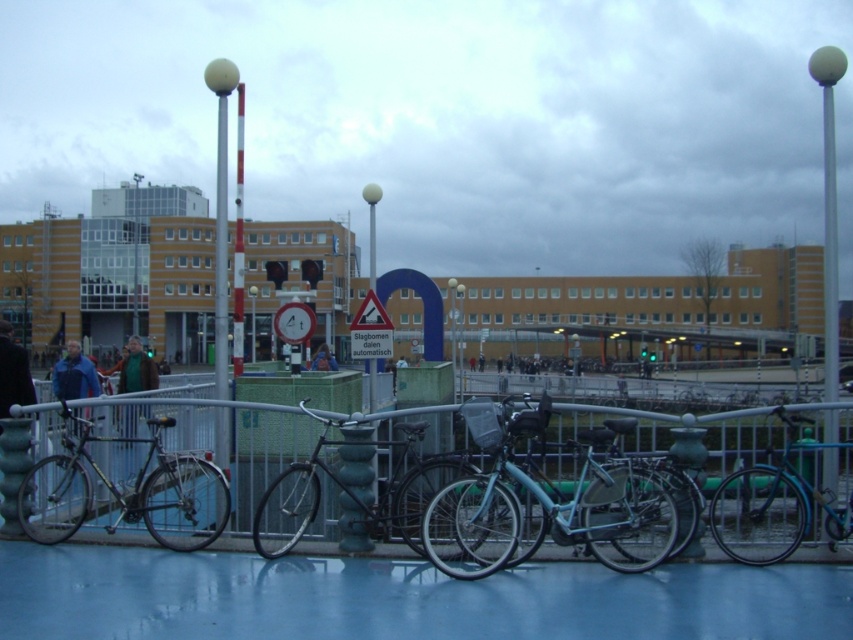
Question: Estimate the real-world distances between objects in this image. Which object is farther from the metallic silver fence at center?

Choices:
 (A) blue matte jacket at left
 (B) green fabric jacket at center

Answer: (B)

Question: Which point is farther from the camera taking this photo?

Choices:
 (A) (294, 305)
 (B) (828, 92)
 (C) (224, 301)
 (D) (318, 348)

Answer: (D)

Question: Where is teal glossy bicycle at right located in relation to polished metal pole at upper center in the image?

Choices:
 (A) left
 (B) right

Answer: (B)

Question: Is polished metal pole at upper center thinner than blue denim jacket at center?

Choices:
 (A) yes
 (B) no

Answer: (B)

Question: Does metallic silver fence at center appear on the right side of blue denim jacket at center?

Choices:
 (A) no
 (B) yes

Answer: (B)

Question: Considering the real-world distances, which object is closest to the teal glossy bicycle at right?

Choices:
 (A) metallic silver fence at center
 (B) metallic triangular sign at center

Answer: (A)